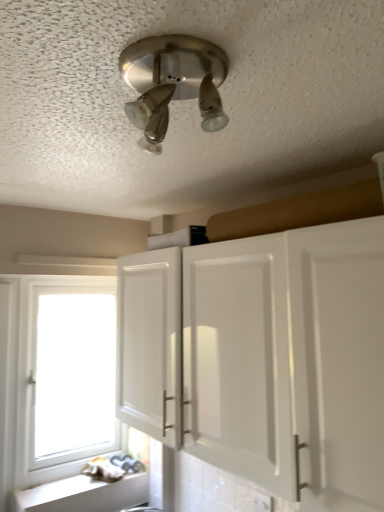
Question: Does white wood window at lower left appear on the left side of white glossy cabinet at center?

Choices:
 (A) yes
 (B) no

Answer: (A)

Question: Is white wood window at lower left shorter than white glossy cabinet at center?

Choices:
 (A) yes
 (B) no

Answer: (B)

Question: Does white wood window at lower left have a smaller size compared to white glossy cabinet at center?

Choices:
 (A) no
 (B) yes

Answer: (B)

Question: Does white wood window at lower left have a greater width compared to white glossy cabinet at center?

Choices:
 (A) no
 (B) yes

Answer: (A)

Question: From a real-world perspective, is white wood window at lower left positioned under white glossy cabinet at center based on gravity?

Choices:
 (A) no
 (B) yes

Answer: (B)

Question: In terms of width, does white wood window at lower left look wider or thinner when compared to white matte counter top at lower left?

Choices:
 (A) wide
 (B) thin

Answer: (B)

Question: From the image's perspective, is white wood window at lower left located above or below white matte counter top at lower left?

Choices:
 (A) below
 (B) above

Answer: (B)

Question: Considering the positions of white wood window at lower left and white matte counter top at lower left in the image, is white wood window at lower left bigger or smaller than white matte counter top at lower left?

Choices:
 (A) small
 (B) big

Answer: (B)

Question: Considering the relative positions of white wood window at lower left and white matte counter top at lower left in the image provided, is white wood window at lower left to the left or to the right of white matte counter top at lower left?

Choices:
 (A) right
 (B) left

Answer: (B)

Question: Is point (266, 504) positioned closer to the camera than point (69, 489)?

Choices:
 (A) farther
 (B) closer

Answer: (B)

Question: Choose the correct answer: Is white plastic electric outlet at lower center inside white matte counter top at lower left or outside it?

Choices:
 (A) outside
 (B) inside

Answer: (A)

Question: In the image, is white plastic electric outlet at lower center on the left side or the right side of white matte counter top at lower left?

Choices:
 (A) right
 (B) left

Answer: (A)

Question: Considering the positions of white plastic electric outlet at lower center and white matte counter top at lower left in the image, is white plastic electric outlet at lower center wider or thinner than white matte counter top at lower left?

Choices:
 (A) thin
 (B) wide

Answer: (A)

Question: In terms of size, does brushed metal light fixture at upper center appear bigger or smaller than white plastic electric outlet at lower center?

Choices:
 (A) small
 (B) big

Answer: (B)

Question: Considering the positions of point coord(178,44) and point coord(256,509), is point coord(178,44) closer or farther from the camera than point coord(256,509)?

Choices:
 (A) closer
 (B) farther

Answer: (A)